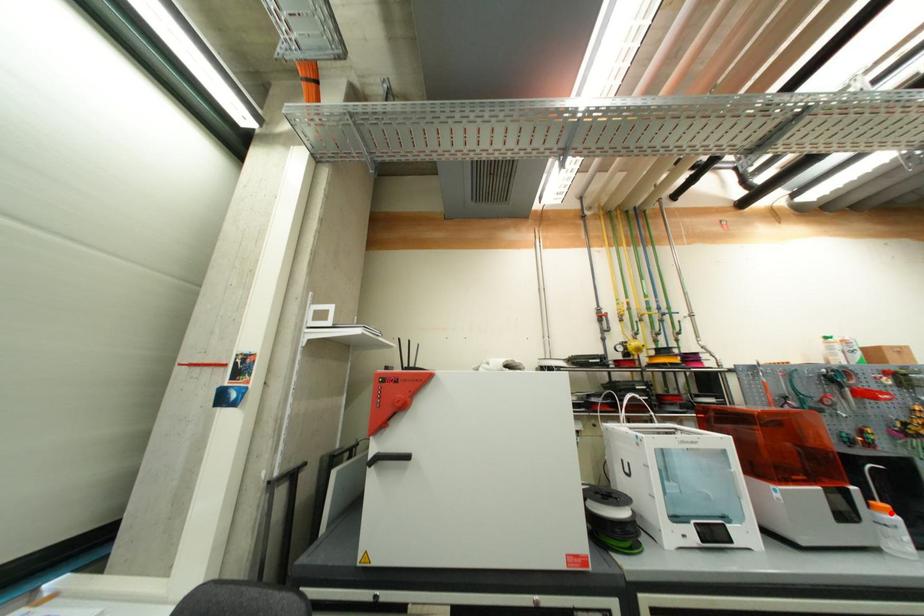
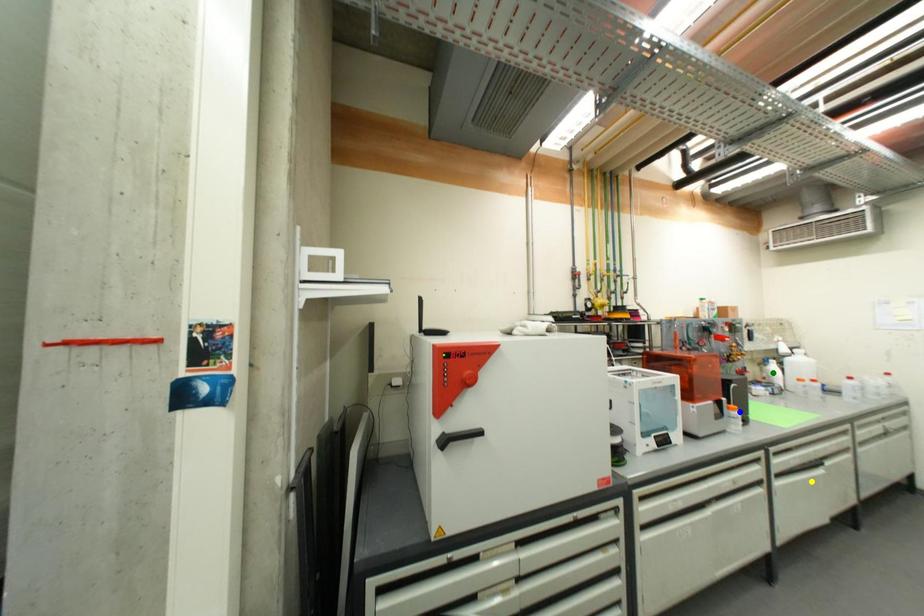
Question: I am providing you with two images of the same scene from different viewpoints. A red point is marked on the first image. You are given multiple points on the second image. Can you choose the point in image 2 that corresponds to the point in image 1?

Choices:
 (A) green point
 (B) yellow point
 (C) blue point

Answer: (C)